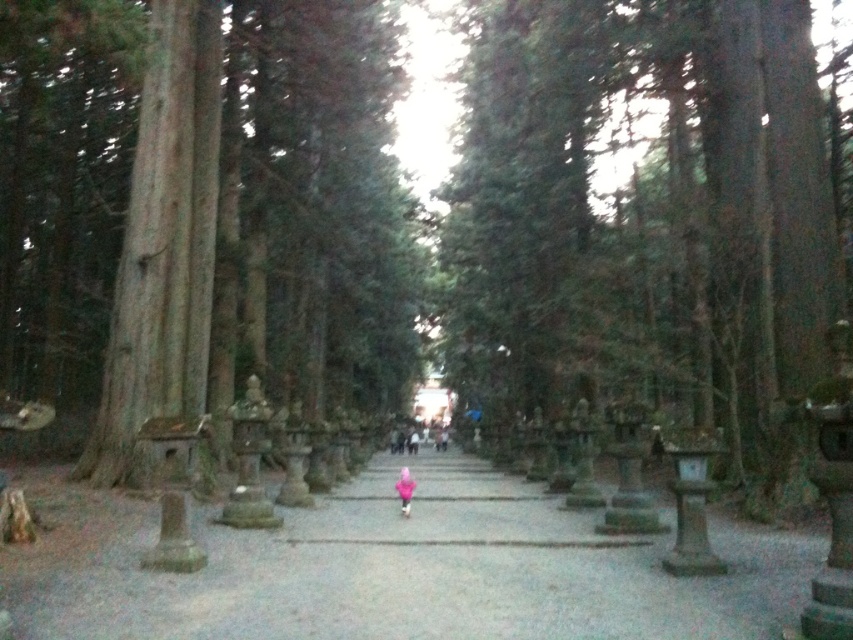
Question: Which point appears closest to the camera in this image?

Choices:
 (A) (399, 444)
 (B) (148, 141)

Answer: (B)

Question: From the image, what is the correct spatial relationship of green textured stone at center in relation to smooth brown tree trunk at left?

Choices:
 (A) left
 (B) right

Answer: (B)

Question: Which of the following is the closest to the observer?

Choices:
 (A) (401, 621)
 (B) (207, 144)

Answer: (A)

Question: Is green textured stone at center positioned in front of smooth brown tree trunk at left?

Choices:
 (A) no
 (B) yes

Answer: (B)

Question: Is gray stone path at center bigger than pink fabric child at center?

Choices:
 (A) yes
 (B) no

Answer: (A)

Question: Which point appears farthest from the camera in this image?

Choices:
 (A) (405, 484)
 (B) (136, 298)

Answer: (A)